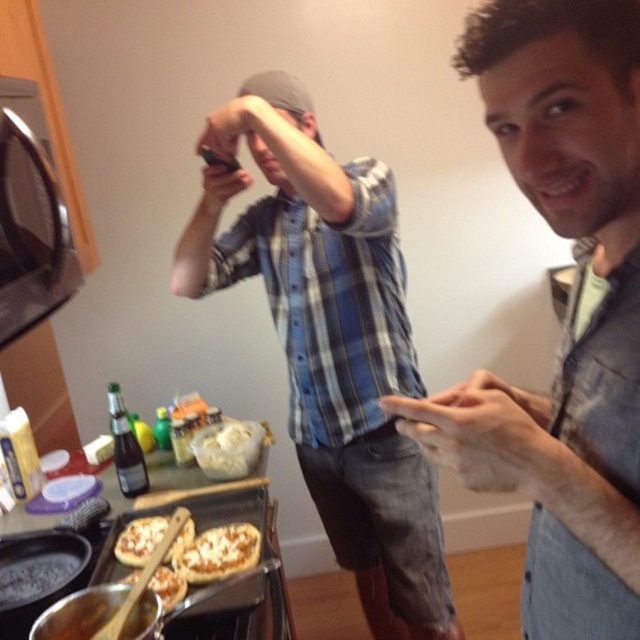
Is black glass exhaust hood at upper left below cheesy pizza at center?

Actually, black glass exhaust hood at upper left is above cheesy pizza at center.

Does point (65, 214) come closer to viewer compared to point (195, 568)?

No, it is behind (195, 568).

Locate an element on the screen. This screenshot has width=640, height=640. black glass exhaust hood at upper left is located at coordinates (29, 218).

Is blue plaid shirt at center further to camera compared to golden crispy pizza at center?

Yes, it is.

Which is below, blue plaid shirt at center or golden crispy pizza at center?

golden crispy pizza at center is lower down.

Does point (266, 256) lie behind point (147, 584)?

That is True.

Locate an element on the screen. blue plaid shirt at center is located at coordinates (330, 340).

Is gray casual shirt at center closer to camera compared to golden crispy pizza at lower left?

Yes, gray casual shirt at center is closer to the viewer.

Does gray casual shirt at center appear under golden crispy pizza at lower left?

Actually, gray casual shirt at center is above golden crispy pizza at lower left.

Is point (636, 88) positioned after point (118, 561)?

That is False.

Where is `gray casual shirt at center`? The image size is (640, 640). gray casual shirt at center is located at coordinates (568, 314).